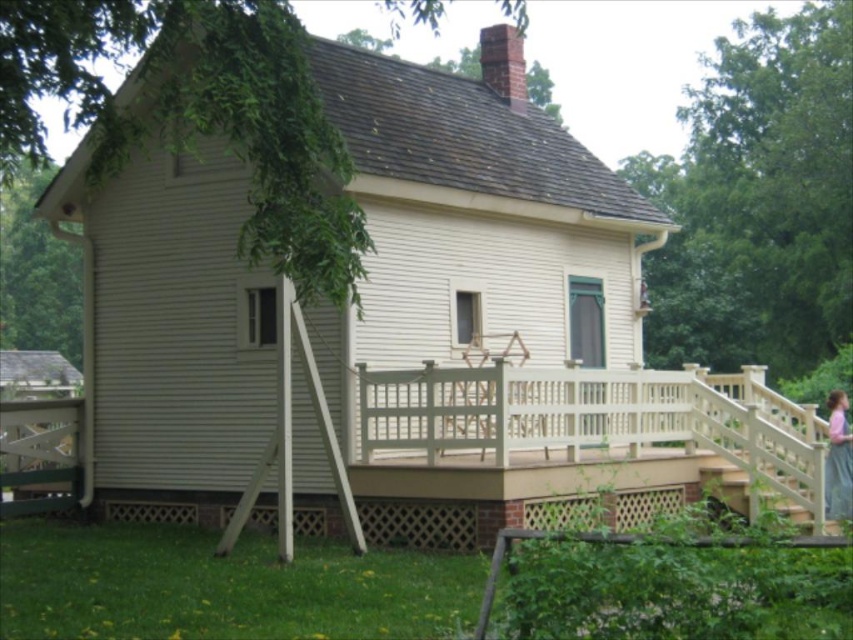
Question: Considering the relative positions of white wooden stairs at lower right and pink fabric dress at upper right in the image provided, where is white wooden stairs at lower right located with respect to pink fabric dress at upper right?

Choices:
 (A) left
 (B) right

Answer: (A)

Question: Does white wooden stairs at lower right have a smaller size compared to pink fabric dress at upper right?

Choices:
 (A) no
 (B) yes

Answer: (B)

Question: Among these points, which one is nearest to the camera?

Choices:
 (A) (843, 497)
 (B) (714, 460)

Answer: (A)

Question: Considering the relative positions of white wooden stairs at lower right and pink fabric dress at upper right in the image provided, where is white wooden stairs at lower right located with respect to pink fabric dress at upper right?

Choices:
 (A) right
 (B) left

Answer: (B)

Question: Which point is farther to the camera?

Choices:
 (A) white wooden stairs at lower right
 (B) pink fabric dress at upper right

Answer: (B)